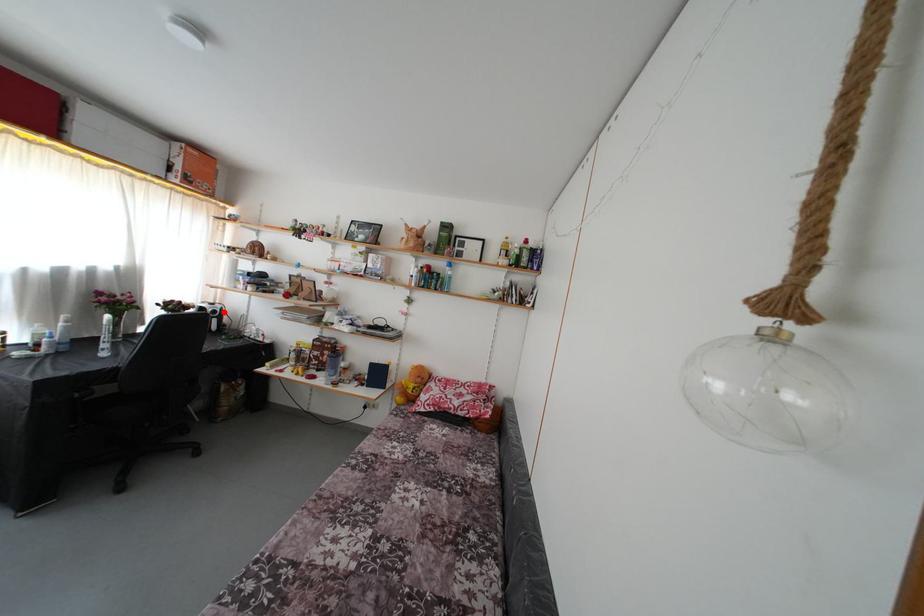
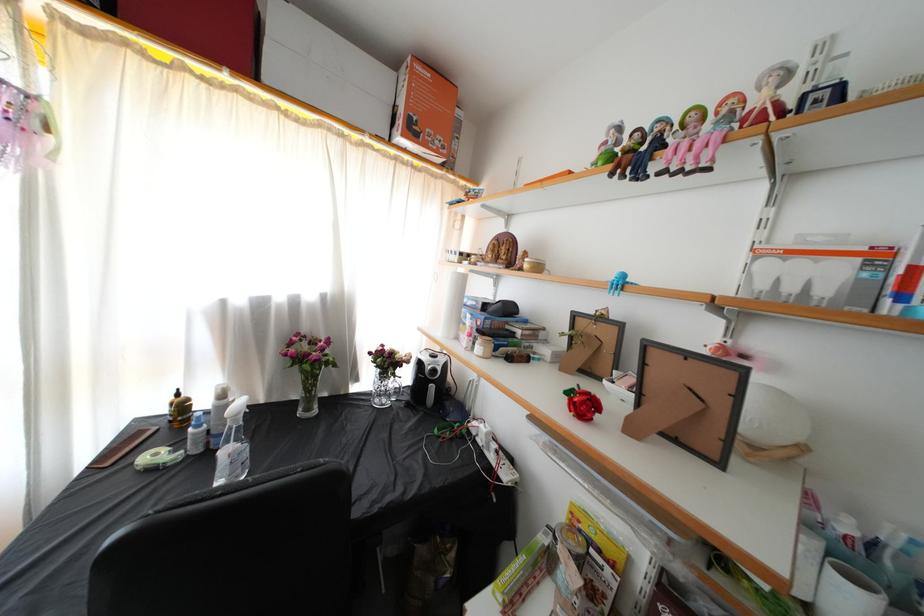
Question: I am providing you with two images of the same scene from different viewpoints. In image1, a red point is highlighted. Considering the same 3D point in image2, which of the following is correct?

Choices:
 (A) It is closer
 (B) It is farther

Answer: (B)